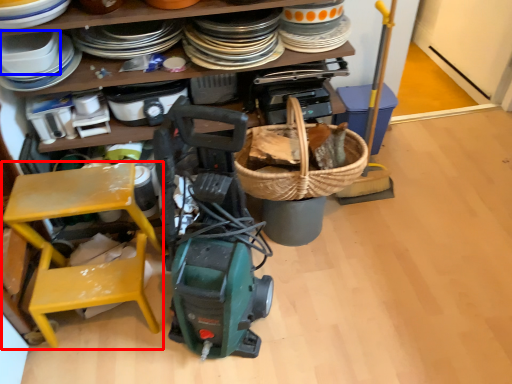
Question: Which of the following is the farthest to the observer, chair (highlighted by a red box) or appliance (highlighted by a blue box)?

Choices:
 (A) chair
 (B) appliance

Answer: (B)